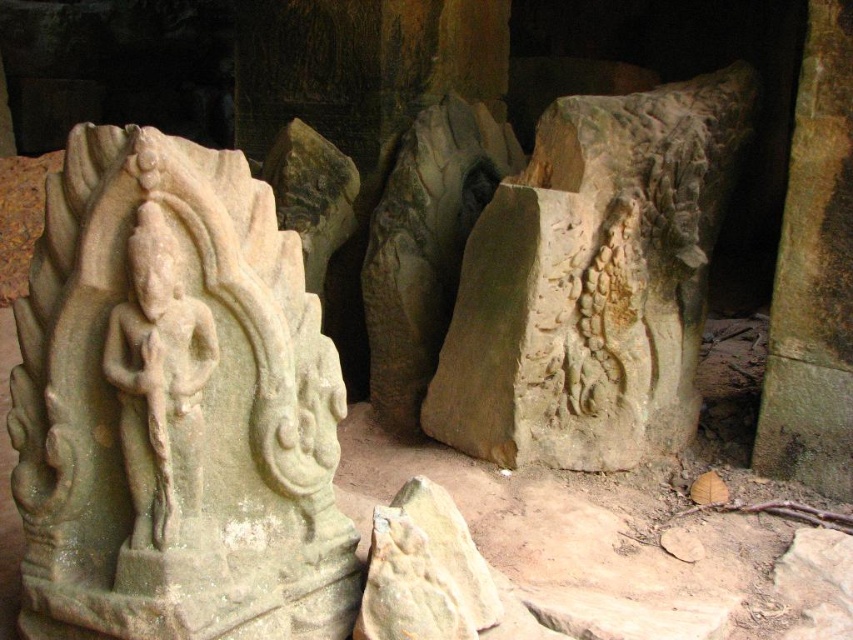
You are an archaeologist examining the ancient stone structure. You need to locate the gray stone carving at center. Based on the coordinates provided, where would you find it in relation to the edges of the structure?

The gray stone carving at center is located at coordinates point 0.441 on the x axis and 0.696 on the y axis, meaning it is positioned 44.1 percent from the left edge and 69.6 percent from the top edge of the structure.

You are an archaeologist examining the ancient stone structure. You notice the gray stone statue at center and the white stone deity at left. Based on their positions, which one is located to the east? Please explain your reasoning.

The gray stone statue at center is to the left of the white stone deity at left. Since the white stone deity at left is positioned further to the left, it would be located to the east if the structure faces north. However, without knowing the structure orientation, we can only state their relative positions. The gray stone statue at center is east of the white stone deity at left because it is to the right of it.

You are an archaeologist examining the ancient stone structure. You notice two central elements, the gray stone statue at center and the gray stone carving at center. Which of these two is narrower in width?

The gray stone statue at center is thinner than the gray stone carving at center, so the gray stone statue at center is narrower in width.